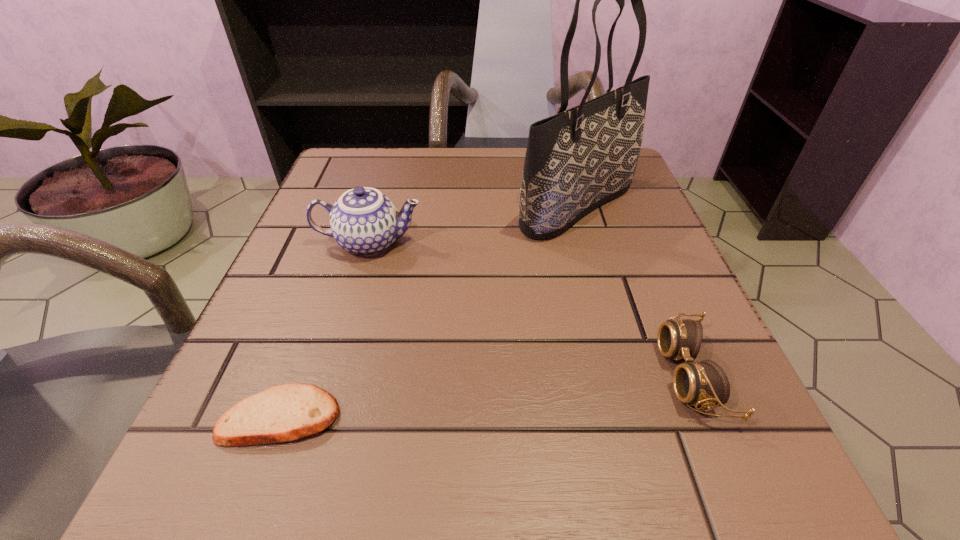
The width and height of the screenshot is (960, 540). Find the location of `the tallest object`. the tallest object is located at coordinates (576, 160).

Where is `chinaware`? chinaware is located at coordinates (363, 221).

The height and width of the screenshot is (540, 960). In order to click on the second shortest object in this screenshot , I will do `click(701, 383)`.

Image resolution: width=960 pixels, height=540 pixels. I want to click on the shortest object, so click(288, 412).

Where is `free spot located on the front of the tote bag`? This screenshot has height=540, width=960. free spot located on the front of the tote bag is located at coordinates click(612, 323).

The image size is (960, 540). I want to click on blank space located 0.300m from the spout of the chinaware, so [589, 243].

Where is `vacant space situated through the lenses of the third tallest object`? Image resolution: width=960 pixels, height=540 pixels. vacant space situated through the lenses of the third tallest object is located at coordinates (589, 375).

Identify the location of vacant area situated through the lenses of the third tallest object. This screenshot has width=960, height=540. (612, 375).

I want to click on blank space located 0.260m through the lenses of the third tallest object, so click(x=469, y=375).

Where is `free spot located 0.350m on the back of the pita bread`? The image size is (960, 540). free spot located 0.350m on the back of the pita bread is located at coordinates (348, 227).